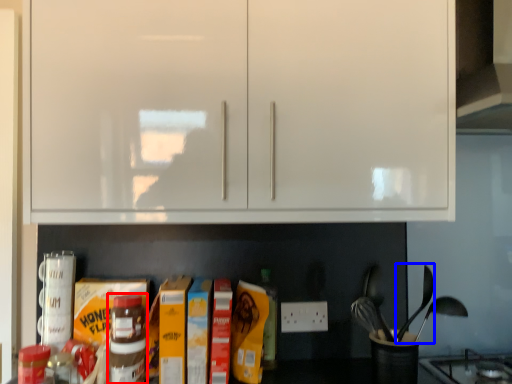
Question: Which point is closer to the camera, bottle (highlighted by a red box) or silverware (highlighted by a blue box)?

Choices:
 (A) bottle
 (B) silverware

Answer: (A)